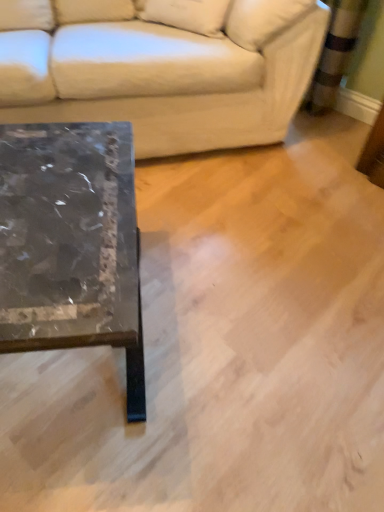
Question: Could you tell me if marble/black at left is facing beige fabric pillow at upper center?

Choices:
 (A) no
 (B) yes

Answer: (A)

Question: Does marble/black at left have a greater width compared to beige fabric pillow at upper center?

Choices:
 (A) no
 (B) yes

Answer: (B)

Question: Is marble/black at left completely or partially outside of beige fabric pillow at upper center?

Choices:
 (A) no
 (B) yes

Answer: (B)

Question: Are marble/black at left and beige fabric pillow at upper center located far from each other?

Choices:
 (A) no
 (B) yes

Answer: (A)

Question: Does marble/black at left have a larger size compared to beige fabric pillow at upper center?

Choices:
 (A) yes
 (B) no

Answer: (A)

Question: Is marble/black at left positioned with its back to beige fabric pillow at upper center?

Choices:
 (A) no
 (B) yes

Answer: (A)

Question: Is beige fabric pillow at upper center far from white leather couch at upper left?

Choices:
 (A) yes
 (B) no

Answer: (B)

Question: Considering the relative sizes of beige fabric pillow at upper center and white leather couch at upper left in the image provided, is beige fabric pillow at upper center taller than white leather couch at upper left?

Choices:
 (A) no
 (B) yes

Answer: (A)

Question: Is beige fabric pillow at upper center positioned beyond the bounds of white leather couch at upper left?

Choices:
 (A) no
 (B) yes

Answer: (A)

Question: Considering the relative sizes of beige fabric pillow at upper center and white leather couch at upper left in the image provided, is beige fabric pillow at upper center smaller than white leather couch at upper left?

Choices:
 (A) no
 (B) yes

Answer: (B)

Question: From the image's perspective, is beige fabric pillow at upper center over white leather couch at upper left?

Choices:
 (A) no
 (B) yes

Answer: (B)

Question: From a real-world perspective, is beige fabric pillow at upper center on white leather couch at upper left?

Choices:
 (A) yes
 (B) no

Answer: (A)

Question: Is the depth of beige fabric pillow at upper center greater than that of marble/black at left?

Choices:
 (A) yes
 (B) no

Answer: (A)